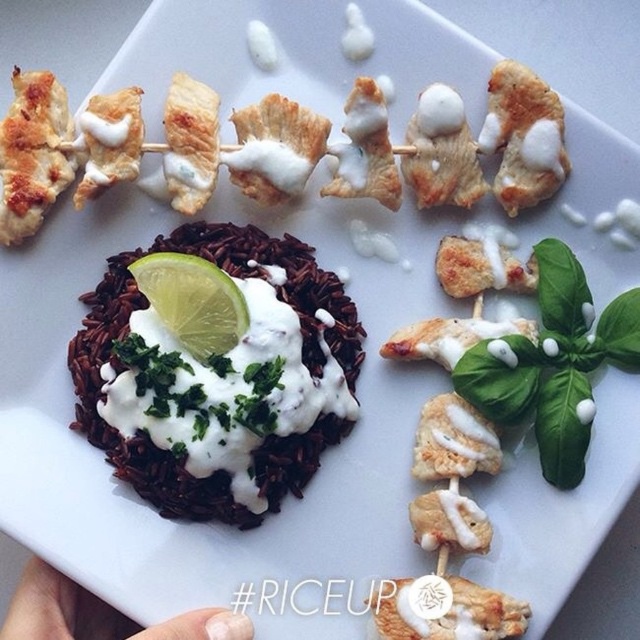
You are a food stylist arranging a plate for a photo shoot. You have a dark brown rice at center and a green leafy basil at lower right. From the viewer perspective, which object appears closer to you?

The dark brown rice at center appears closer to the viewer since it is in front of the green leafy basil at lower right.

You are a food stylist arranging a plate of rice with sauce and herbs. You have two points on the plate where you can place the lime slice. The points are point (506, 202) and point (480, 589). Which point is closer to the viewer so that the lime will look more prominent?

Point (506, 202) is further to the viewer than point (480, 589), so placing the lime slice at point (506, 202) will make it look more prominent because it is closer to the viewer.